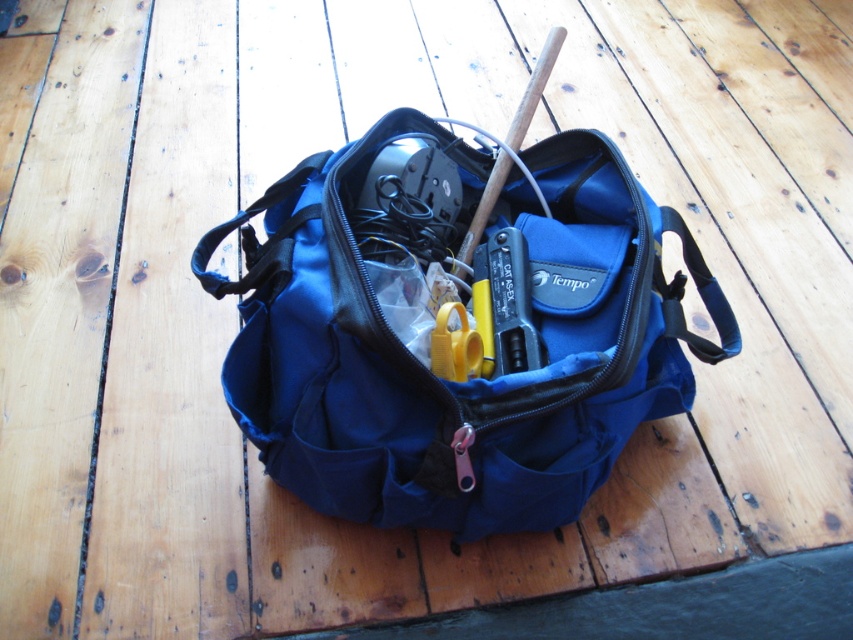
Can you confirm if blue fabric tool bag at center is positioned below yellow plastic scissors at center?

Actually, blue fabric tool bag at center is above yellow plastic scissors at center.

Who is more forward, (428, 182) or (466, 330)?

Positioned in front is point (466, 330).

I want to click on blue fabric tool bag at center, so tap(425, 364).

Can you confirm if metallic gray tool at center is positioned below yellow plastic scissors at center?

No.

Can you confirm if metallic gray tool at center is thinner than yellow plastic scissors at center?

Incorrect, metallic gray tool at center's width is not less than yellow plastic scissors at center's.

Between point (483, 260) and point (467, 342), which one is positioned in front?

Point (467, 342) is in front.

Where is `metallic gray tool at center`? The height and width of the screenshot is (640, 853). metallic gray tool at center is located at coordinates (503, 305).

Which of these two, blue fabric tool bag at center or metallic gray tool at center, stands taller?

Standing taller between the two is blue fabric tool bag at center.

Can you confirm if blue fabric tool bag at center is wider than metallic gray tool at center?

Correct, the width of blue fabric tool bag at center exceeds that of metallic gray tool at center.

Between point (642, 397) and point (509, 337), which one is positioned behind?

Positioned behind is point (642, 397).

Find the location of a particular element. The width and height of the screenshot is (853, 640). blue fabric tool bag at center is located at coordinates (425, 364).